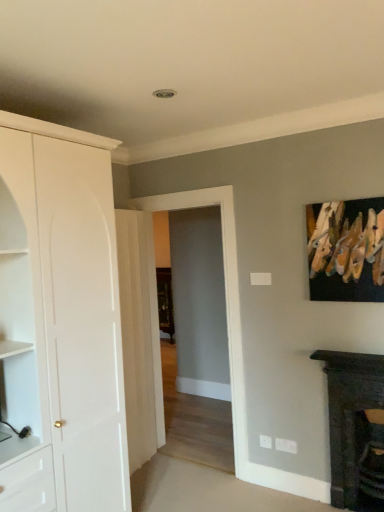
Question: From a real-world perspective, is transparent glass door at center located higher than wooden clothespins at upper right?

Choices:
 (A) yes
 (B) no

Answer: (B)

Question: From a real-world perspective, is transparent glass door at center positioned under wooden clothespins at upper right based on gravity?

Choices:
 (A) no
 (B) yes

Answer: (B)

Question: Is transparent glass door at center aimed at wooden clothespins at upper right?

Choices:
 (A) no
 (B) yes

Answer: (A)

Question: Are transparent glass door at center and wooden clothespins at upper right far apart?

Choices:
 (A) yes
 (B) no

Answer: (B)

Question: Is transparent glass door at center outside wooden clothespins at upper right?

Choices:
 (A) no
 (B) yes

Answer: (B)

Question: Relative to transparent glass door at center, is wooden clothespins at upper right in front or behind?

Choices:
 (A) behind
 (B) front

Answer: (B)

Question: Is wooden clothespins at upper right bigger or smaller than transparent glass door at center?

Choices:
 (A) big
 (B) small

Answer: (B)

Question: Considering the positions of point (345, 207) and point (160, 417), is point (345, 207) closer or farther from the camera than point (160, 417)?

Choices:
 (A) farther
 (B) closer

Answer: (B)

Question: From the image's perspective, is wooden clothespins at upper right above or below transparent glass door at center?

Choices:
 (A) below
 (B) above

Answer: (B)

Question: Relative to wooden clothespins at upper right, is transparent glass door at center in front or behind?

Choices:
 (A) behind
 (B) front

Answer: (A)

Question: From a real-world perspective, is transparent glass door at center above or below wooden clothespins at upper right?

Choices:
 (A) above
 (B) below

Answer: (B)

Question: Considering the relative positions of transparent glass door at center and wooden clothespins at upper right in the image provided, is transparent glass door at center to the left or to the right of wooden clothespins at upper right?

Choices:
 (A) right
 (B) left

Answer: (B)

Question: Looking at the image, does transparent glass door at center seem bigger or smaller compared to wooden clothespins at upper right?

Choices:
 (A) small
 (B) big

Answer: (B)

Question: Is wooden clothespins at upper right to the left or to the right of white matte cabinet at left in the image?

Choices:
 (A) right
 (B) left

Answer: (A)

Question: From a real-world perspective, is wooden clothespins at upper right positioned above or below white matte cabinet at left?

Choices:
 (A) below
 (B) above

Answer: (B)